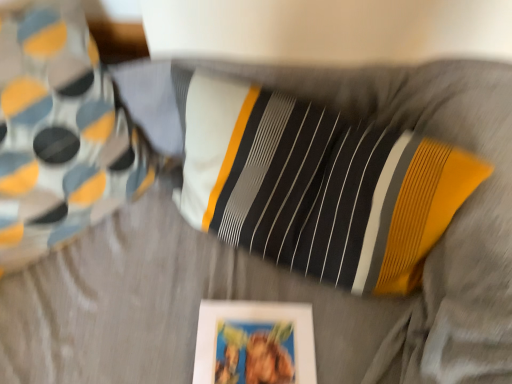
At what (x,y) coordinates should I click in order to perform the action: click on vacant point above matte white picture frame at lower center (from a real-world perspective). Please return your answer as a coordinate pair (x, y). The height and width of the screenshot is (384, 512). Looking at the image, I should click on (254, 354).